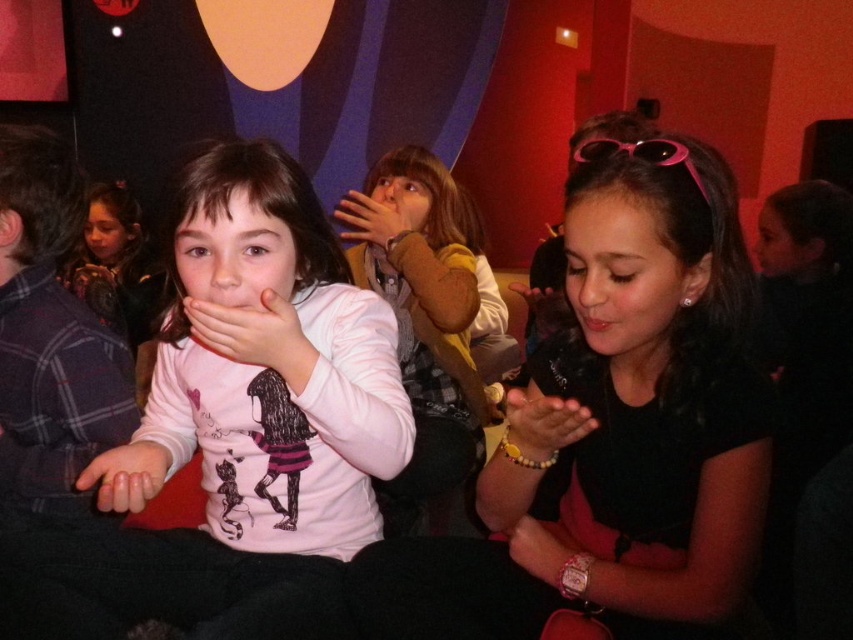
Consider the image. You are a photographer at the event and want to capture a closeup of the smooth beige hand at center and the matte black bracelet at lower center. Which object should you focus on if you want to highlight the one that is taller?

The smooth beige hand at center is taller than the matte black bracelet at lower center, so you should focus on the smooth beige hand at center to highlight its height.

You are a photographer standing at the entrance of the room. You want to take a photo of the black matte shirt at center. Where should you position yourself to capture the shirt in the center of your camera frame?

Since the black matte shirt at center is located at point 0.641 on the x axis and 0.750 on the y axis, you should position yourself so that your camera frame is centered at those coordinates to capture the shirt in the center of your view.

You are a photographer at this event. You want to take a photo of the black matte shirt at center without the smooth pink skin at lower left appearing in the frame. Is this possible based on their positions?

The black matte shirt at center is positioned over the smooth pink skin at lower left, so it is not possible to capture the black matte shirt at center without the smooth pink skin at lower left appearing in the frame.